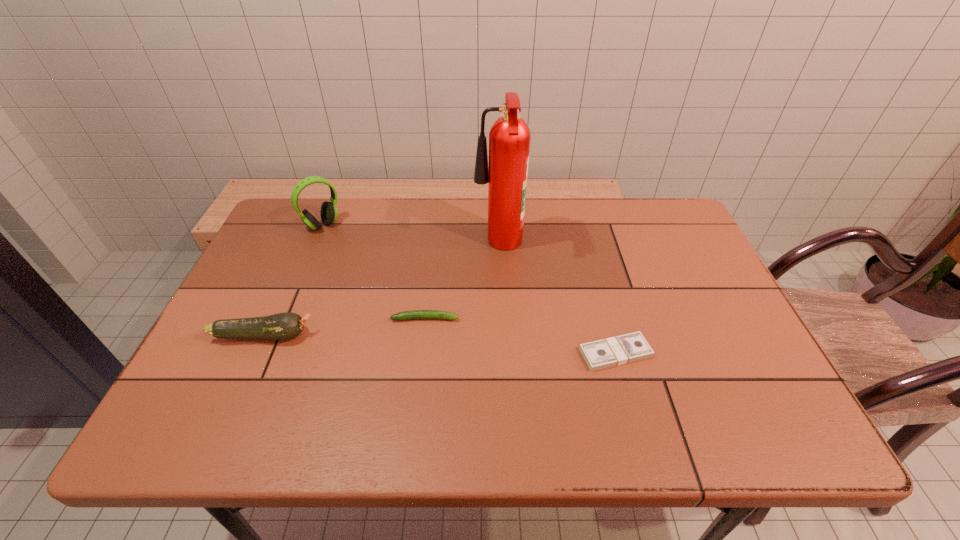
The image size is (960, 540). What are the coordinates of `vacant area that lies between the farther zucchini and the fourth shortest object` in the screenshot? It's located at (374, 272).

Where is `empty space between the third nearest object and the rightmost object`? The height and width of the screenshot is (540, 960). empty space between the third nearest object and the rightmost object is located at coordinates (x=520, y=336).

This screenshot has width=960, height=540. Find the location of `vacant area between the left zucchini and the third object from left to right`. vacant area between the left zucchini and the third object from left to right is located at coordinates (345, 327).

This screenshot has height=540, width=960. Identify the location of free space between the rightmost object and the fourth object from left to right. [557, 300].

The width and height of the screenshot is (960, 540). In order to click on empty space that is in between the dollar and the fire extinguisher in this screenshot , I will do `click(557, 300)`.

Point out which object is positioned as the third nearest to the fourth object from left to right. Please provide its 2D coordinates. Your answer should be formatted as a tuple, i.e. [(x, y)], where the tuple contains the x and y coordinates of a point satisfying the conditions above.

[(328, 212)]

Identify which object is the third closest to the shortest object. Please provide its 2D coordinates. Your answer should be formatted as a tuple, i.e. [(x, y)], where the tuple contains the x and y coordinates of a point satisfying the conditions above.

[(283, 326)]

Find the location of a particular element. free space that satisfies the following two spatial constraints: 1. at the nozzle of the shortest object; 2. on the right side of the second object from right to left is located at coordinates (503, 353).

Identify the location of vacant space that satisfies the following two spatial constraints: 1. on the front-facing side of the shortest object; 2. on the left side of the right zucchini. (421, 353).

Find the location of a particular element. The width and height of the screenshot is (960, 540). blank area in the image that satisfies the following two spatial constraints: 1. at the blossom end of the third tallest object; 2. on the left side of the rightmost object is located at coordinates (256, 353).